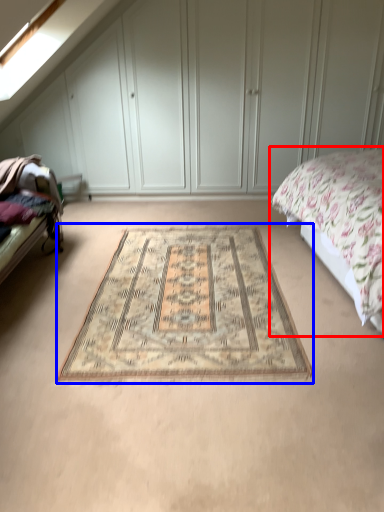
Question: Among these objects, which one is nearest to the camera, bed (highlighted by a red box) or mat (highlighted by a blue box)?

Choices:
 (A) bed
 (B) mat

Answer: (A)